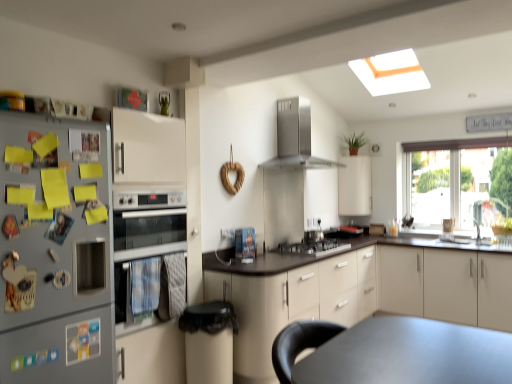
Image resolution: width=512 pixels, height=384 pixels. What do you see at coordinates (314, 247) in the screenshot?
I see `satin silver gas stove at center` at bounding box center [314, 247].

Find the location of a particular element. The height and width of the screenshot is (384, 512). satin silver cooktop at center is located at coordinates (x=313, y=236).

Describe the element at coordinates (291, 303) in the screenshot. The height and width of the screenshot is (384, 512). I see `beige matte cabinet at center, acting as the third cabinetry starting from the right` at that location.

This screenshot has width=512, height=384. What do you see at coordinates (148, 255) in the screenshot? I see `silver metallic oven at left` at bounding box center [148, 255].

The height and width of the screenshot is (384, 512). What are the coordinates of `satin silver gas stove at center` in the screenshot? It's located at (314, 247).

Who is more distant, black plastic trash can at lower center or stainless steel range hood at upper center?

Positioned behind is stainless steel range hood at upper center.

Between black plastic trash can at lower center and stainless steel range hood at upper center, which one has larger size?

stainless steel range hood at upper center is bigger.

Could you tell me if white matte cabinet at upper center, the second cabinetry viewed from the right, is facing beige matte cabinet at right, the third cabinetry from the left?

No, white matte cabinet at upper center, the second cabinetry viewed from the right, is not aimed at beige matte cabinet at right, the third cabinetry from the left.

Considering the relative sizes of white matte cabinet at upper center, which is counted as the second cabinetry, starting from the left, and beige matte cabinet at right, the third cabinetry from the left, in the image provided, is white matte cabinet at upper center, which is counted as the second cabinetry, starting from the left, bigger than beige matte cabinet at right, the third cabinetry from the left,?

Incorrect, white matte cabinet at upper center, which is counted as the second cabinetry, starting from the left, is not larger than beige matte cabinet at right, the third cabinetry from the left.

Is point (340, 177) behind point (447, 295)?

Yes, it is behind point (447, 295).

Considering the relative positions of silver metallic oven at left and satin silver cooktop at center in the image provided, is silver metallic oven at left behind satin silver cooktop at center?

No, it is in front of satin silver cooktop at center.

The image size is (512, 384). I want to click on appliance directly beneath the silver metallic oven at left (from a real-world perspective), so click(x=313, y=236).

Where is `bar stool lying in front of the satin silver gas stove at center`? This screenshot has height=384, width=512. bar stool lying in front of the satin silver gas stove at center is located at coordinates (209, 341).

How different are the orientations of satin silver gas stove at center and black plastic trash can at lower center in degrees?

The angular difference between satin silver gas stove at center and black plastic trash can at lower center is 0.907 degrees.

Is satin silver gas stove at center closer to the viewer compared to black plastic trash can at lower center?

No, the depth of satin silver gas stove at center is greater than that of black plastic trash can at lower center.

From the image's perspective, is satin silver gas stove at center above or below black plastic trash can at lower center?

satin silver gas stove at center is above black plastic trash can at lower center.

Does satin silver cooktop at center have a lesser height compared to transparent glass window at right?

Correct, satin silver cooktop at center is not as tall as transparent glass window at right.

Measure the distance from satin silver cooktop at center to transparent glass window at right.

They are 2.04 meters apart.

From a real-world perspective, is satin silver cooktop at center on top of transparent glass window at right?

No, from a real-world perspective, satin silver cooktop at center is not over transparent glass window at right

Which object is wider, satin silver cooktop at center or transparent glass window at right?

Wider between the two is satin silver cooktop at center.

From the image's perspective, would you say white matte cabinet at upper center, the second cabinetry viewed from the right, is shown under satin silver gas stove at center?

No.

Starting from the satin silver gas stove at center, which cabinetry is the 2nd one behind? Please provide its 2D coordinates.

[(354, 186)]

From the picture: Are white matte cabinet at upper center, the second cabinetry viewed from the right, and satin silver gas stove at center beside each other?

No, white matte cabinet at upper center, the second cabinetry viewed from the right, is not touching satin silver gas stove at center.

Between white matte cabinet at upper center, the second cabinetry viewed from the right, and satin silver gas stove at center, which one has smaller width?

Thinner between the two is white matte cabinet at upper center, the second cabinetry viewed from the right.

In the scene shown: Considering the relative positions of beige matte cabinet at center, acting as the third cabinetry starting from the right, and transparent glass window at right in the image provided, is beige matte cabinet at center, acting as the third cabinetry starting from the right, to the right of transparent glass window at right from the viewer's perspective?

Incorrect, beige matte cabinet at center, acting as the third cabinetry starting from the right, is not on the right side of transparent glass window at right.

From the image's perspective, which one is positioned higher, beige matte cabinet at center, acting as the third cabinetry starting from the right, or transparent glass window at right?

transparent glass window at right, from the image's perspective.

From a real-world perspective, is beige matte cabinet at center, acting as the third cabinetry starting from the right, located higher than transparent glass window at right?

No.

Based on the photo, which object is more forward, beige matte cabinet at center, the 1th cabinetry from the left, or transparent glass window at right?

beige matte cabinet at center, the 1th cabinetry from the left.

Where is `kitchen appliance above the black plastic trash can at lower center (from the image's perspective)`? Image resolution: width=512 pixels, height=384 pixels. kitchen appliance above the black plastic trash can at lower center (from the image's perspective) is located at coordinates (295, 138).

In order to click on the 2nd cabinetry located beneath the white matte cabinet at upper center, the second cabinetry viewed from the right (from a real-world perspective) in this screenshot , I will do `click(447, 285)`.

From the image, which object appears to be nearer to silver metallic oven at left, satin silver gas stove at center or beige matte cabinet at right, the third cabinetry from the left?

Among the two, satin silver gas stove at center is located nearer to silver metallic oven at left.

In the scene shown: Which object lies further to the anchor point transparent glass window at right, beige matte cabinet at center, the 1th cabinetry from the left, or beige matte cabinet at right, the first cabinetry positioned from the right?

beige matte cabinet at center, the 1th cabinetry from the left, lies further to transparent glass window at right than the other object.

Considering their positions, is white matte cabinet at upper center, the second cabinetry viewed from the right, positioned further to beige matte cabinet at right, the first cabinetry positioned from the right, than stainless steel range hood at upper center?

stainless steel range hood at upper center lies further to beige matte cabinet at right, the first cabinetry positioned from the right, than the other object.

Looking at the image, which one is located further to transparent glass window at right, black plastic trash can at lower center or stainless steel range hood at upper center?

Based on the image, black plastic trash can at lower center appears to be further to transparent glass window at right.

Looking at the image, which one is located further to satin silver gas stove at center, stainless steel range hood at upper center or beige matte cabinet at right, the third cabinetry from the left?

Among the two, beige matte cabinet at right, the third cabinetry from the left, is located further to satin silver gas stove at center.

Estimate the real-world distances between objects in this image. Which object is closer to white matte cabinet at upper center, the second cabinetry viewed from the right, black plastic trash can at lower center or silver metallic refrigerator at left?

Based on the image, black plastic trash can at lower center appears to be nearer to white matte cabinet at upper center, the second cabinetry viewed from the right.

Considering their positions, is black plastic trash can at lower center positioned further to satin silver gas stove at center than beige matte cabinet at right, the first cabinetry positioned from the right?

The object further to satin silver gas stove at center is black plastic trash can at lower center.

Considering their positions, is stainless steel range hood at upper center positioned closer to silver metallic refrigerator at left than beige matte cabinet at center, the 1th cabinetry from the left?

The object closer to silver metallic refrigerator at left is beige matte cabinet at center, the 1th cabinetry from the left.

Identify the location of oven located between silver metallic refrigerator at left and beige matte cabinet at center, acting as the third cabinetry starting from the right, in the left-right direction. The width and height of the screenshot is (512, 384). (148, 255).

Identify the location of appliance between stainless steel range hood at upper center and beige matte cabinet at right, the first cabinetry positioned from the right. This screenshot has height=384, width=512. (313, 236).

Where is `gas stove between silver metallic refrigerator at left and beige matte cabinet at right, the first cabinetry positioned from the right, from left to right`? The height and width of the screenshot is (384, 512). gas stove between silver metallic refrigerator at left and beige matte cabinet at right, the first cabinetry positioned from the right, from left to right is located at coordinates (314, 247).

I want to click on bar stool positioned between silver metallic oven at left and satin silver cooktop at center from near to far, so coord(209,341).